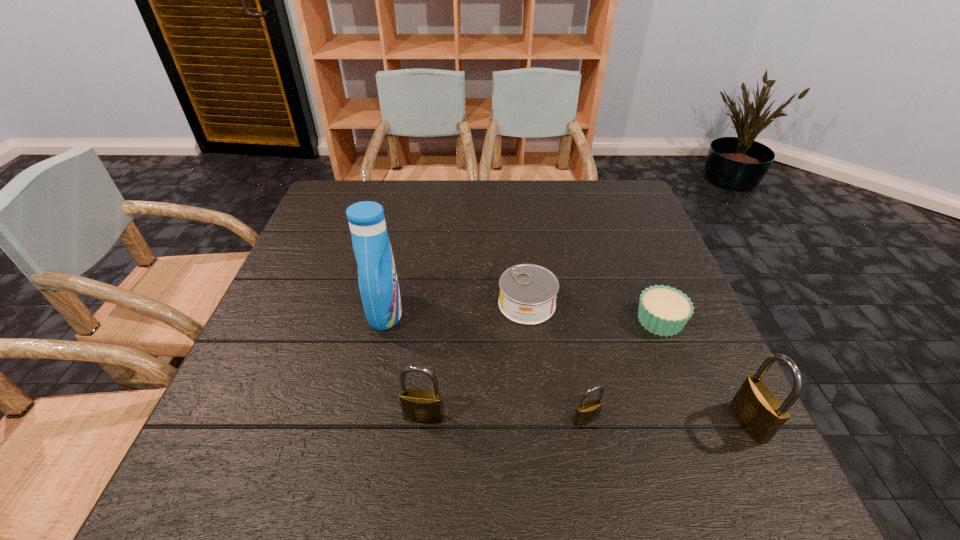
Where is `free space located on the left of the second padlock from left to right`? The height and width of the screenshot is (540, 960). free space located on the left of the second padlock from left to right is located at coordinates [468, 420].

Find the location of a particular element. free spot located on the back of the rightmost object is located at coordinates (675, 272).

You are a GUI agent. You are given a task and a screenshot of the screen. Output one action in this format:
    pyautogui.click(x=<x>, y=<y>)
    Task: Click on the free spot located on the right of the can
    Image resolution: width=960 pixels, height=540 pixels.
    Given the screenshot: What is the action you would take?
    pyautogui.click(x=637, y=304)

The height and width of the screenshot is (540, 960). I want to click on vacant area located on the left of the fifth object from left to right, so click(469, 320).

The image size is (960, 540). What are the coordinates of `vacant area situated on the front-facing side of the leftmost object` in the screenshot? It's located at (481, 313).

Find the location of `padlock present at the right edge`. padlock present at the right edge is located at coordinates (758, 410).

Identify the location of cupcake that is at the right edge. This screenshot has width=960, height=540. (663, 310).

I want to click on object present at the near right corner, so click(x=758, y=410).

The height and width of the screenshot is (540, 960). I want to click on vacant region at the far edge of the desktop, so click(538, 183).

This screenshot has height=540, width=960. I want to click on vacant area at the near edge, so [x=310, y=427].